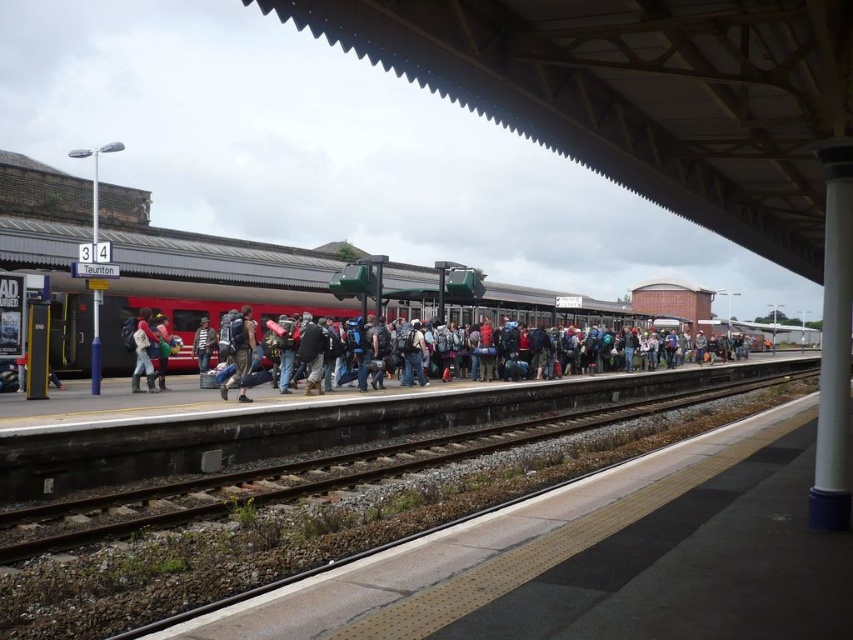
You are a traveler on the train station platform. You see a camouflage fabric backpack at center and a striped sweater at center. Which item is higher up from the ground?

The camouflage fabric backpack at center is above the striped sweater at center, so it is higher up from the ground.

You are a passenger on the train station platform and want to pick up your camouflage fabric backpack at center and matte black backpack at center. Which backpack should you move towards first to reach the one closer to you?

The camouflage fabric backpack at center is closer to you since it is in front of the matte black backpack at center.